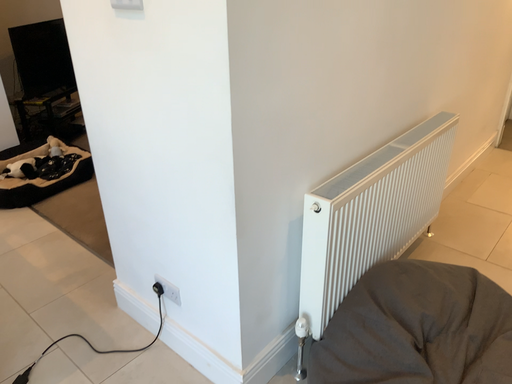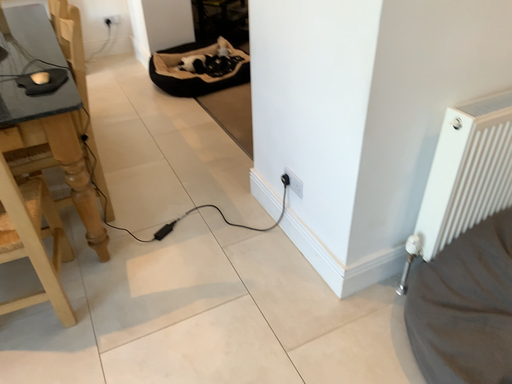
Question: Which way did the camera rotate in the video?

Choices:
 (A) rotated upward
 (B) rotated downward

Answer: (B)